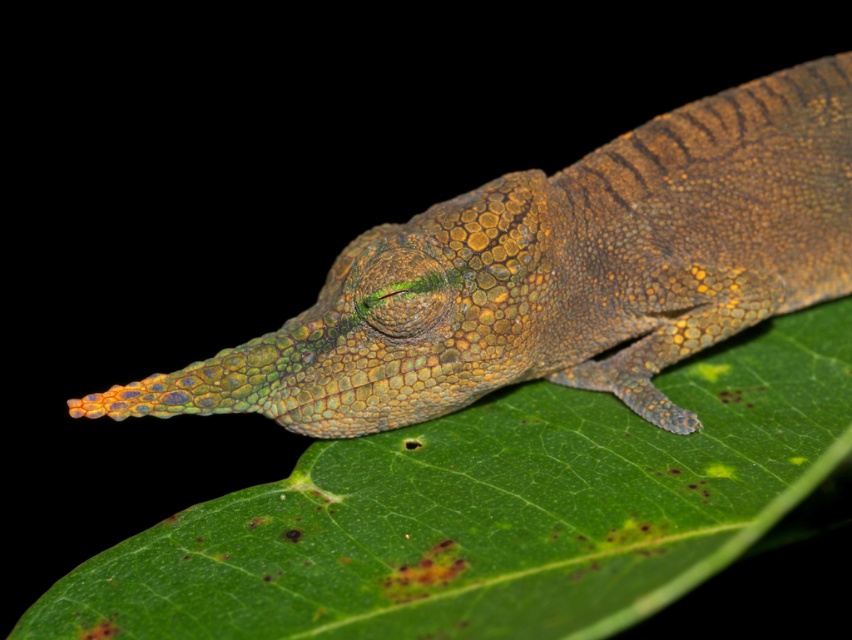
Question: Which of the following is the farthest from the observer?

Choices:
 (A) green scaly lizard at center
 (B) green matte leaf at center

Answer: (A)

Question: Considering the relative positions of green matte leaf at center and green scaly lizard at center in the image provided, where is green matte leaf at center located with respect to green scaly lizard at center?

Choices:
 (A) right
 (B) left

Answer: (B)

Question: Is green matte leaf at center to the right of green scaly lizard at center from the viewer's perspective?

Choices:
 (A) no
 (B) yes

Answer: (A)

Question: Is green matte leaf at center above green scaly lizard at center?

Choices:
 (A) yes
 (B) no

Answer: (B)